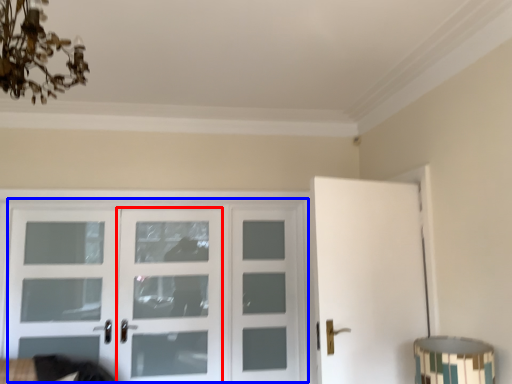
Question: Which object appears farthest to the camera in this image, screen door (highlighted by a red box) or door (highlighted by a blue box)?

Choices:
 (A) screen door
 (B) door

Answer: (A)